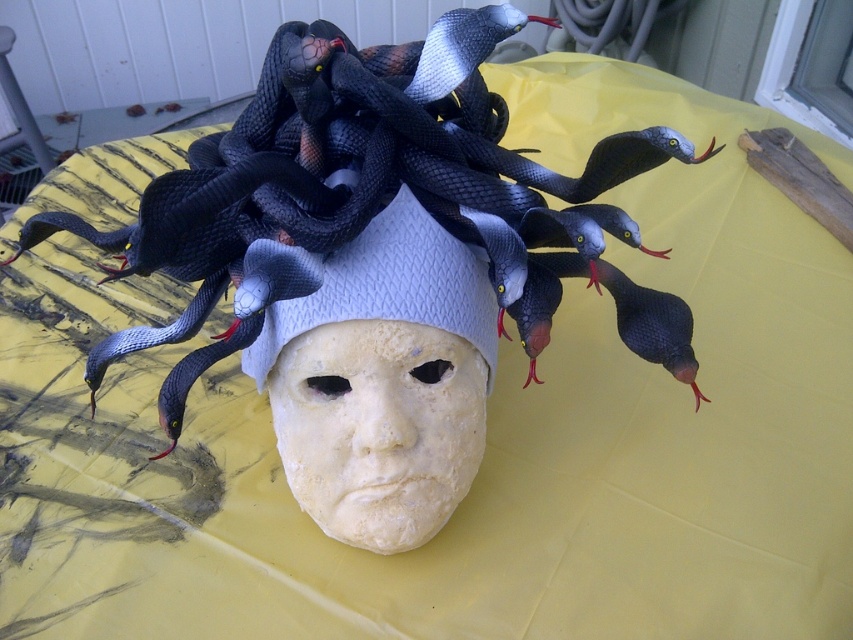
Can you confirm if black matte snakes at center is positioned to the left of white matte headdress at center?

Correct, you'll find black matte snakes at center to the left of white matte headdress at center.

Which is in front, point (310, 102) or point (368, 304)?

Point (310, 102) is more forward.

Where is `black matte snakes at center`? The height and width of the screenshot is (640, 853). black matte snakes at center is located at coordinates (357, 188).